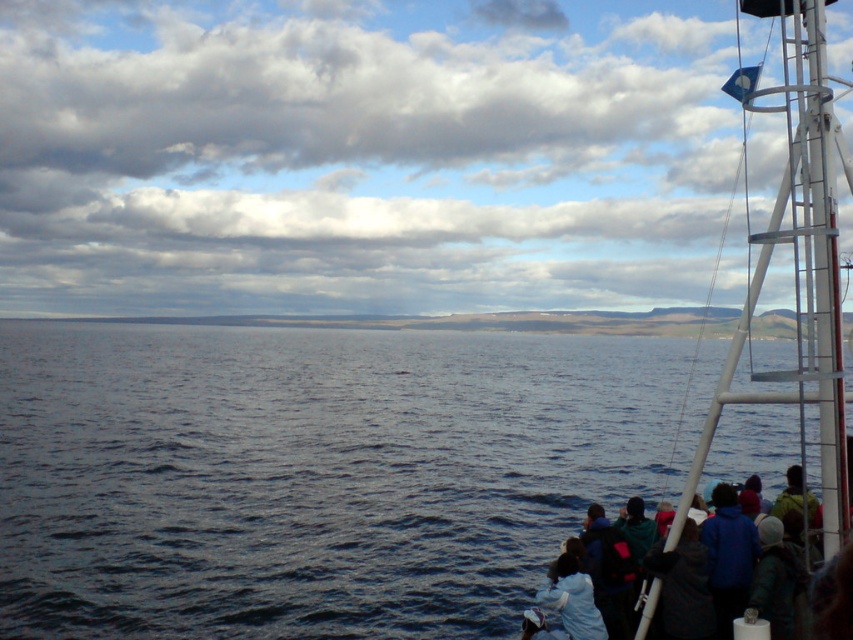
Question: Is white metal boat at right thinner than blue jacket at lower right?

Choices:
 (A) yes
 (B) no

Answer: (B)

Question: Is dark blue water at center wider than white metal boat at right?

Choices:
 (A) yes
 (B) no

Answer: (A)

Question: Is dark blue water at center to the left of white metal boat at right from the viewer's perspective?

Choices:
 (A) yes
 (B) no

Answer: (A)

Question: Which of the following is the farthest from the observer?

Choices:
 (A) (840, 602)
 (B) (804, 134)
 (C) (616, 488)

Answer: (C)

Question: Based on their relative distances, which object is nearer to the blue jacket at lower right?

Choices:
 (A) dark blue water at center
 (B) white metal boat at right

Answer: (B)

Question: Which object appears farthest from the camera in this image?

Choices:
 (A) dark blue water at center
 (B) white metal boat at right
 (C) blue jacket at lower right

Answer: (A)